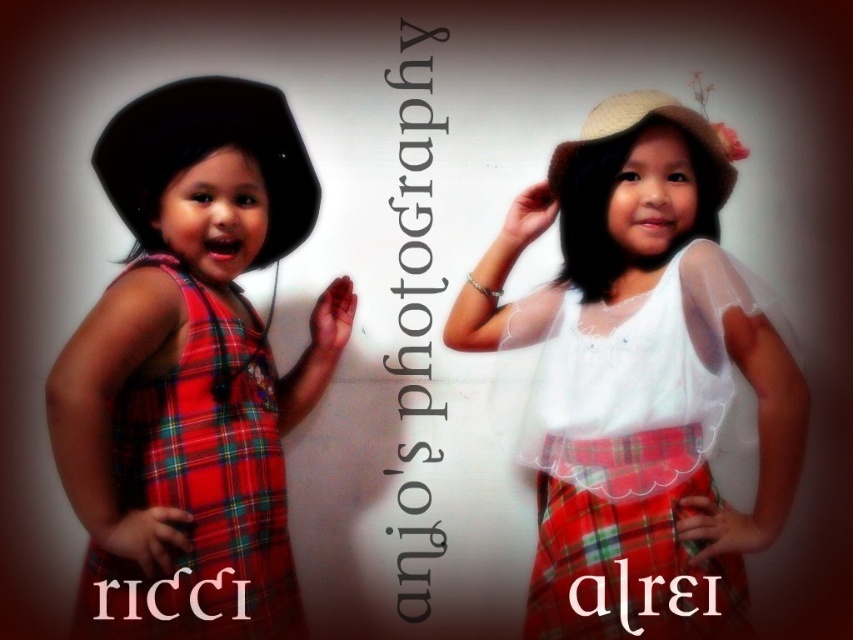
You are a photographer who wants to ensure the text doesn not cover any important parts of the children. Which clothing item, the matte white blouse at center or the matte plaid dress at left, is more likely to be obscured by the text?

The matte white blouse at center is larger in size than the matte plaid dress at left, so the text is more likely to obscure the matte white blouse at center since it covers a bigger area.

You are a photographer who wants to place a name tag on the tallest clothing item in the image. Which clothing item should you choose between the matte white blouse at center and the matte plaid dress at left?

The matte white blouse at center is taller than the matte plaid dress at left, so you should place the name tag on the matte white blouse at center.